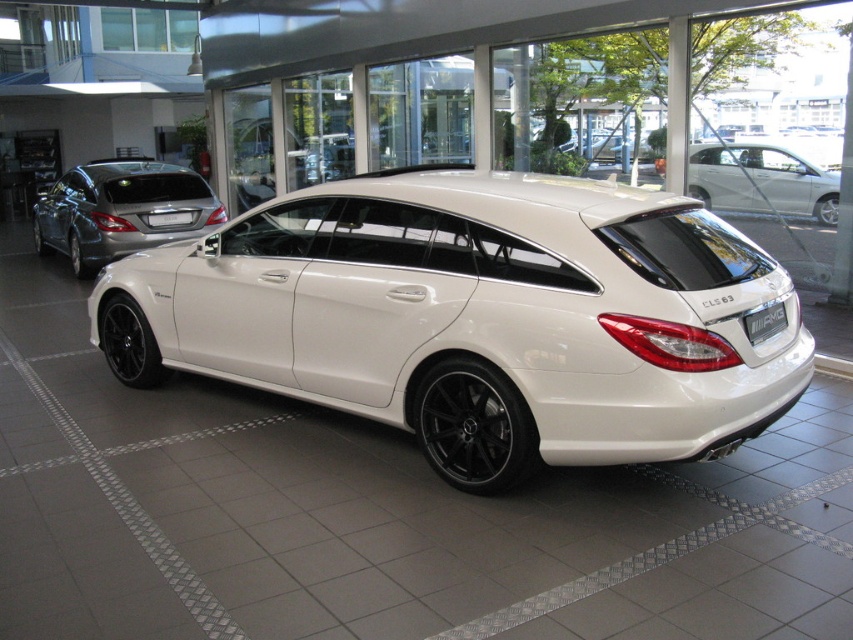
You are standing at the point marked as point [471,396] in the showroom where the Mercedes is displayed. You want to take a photo of the car from exactly 4 meters away. Can you step forward or backward to achieve this distance?

The distance between you and the camera is currently 3.92 meters. To reach exactly 4 meters, you should step backward slightly so that the total distance becomes 4 meters.

You are a delivery person who needs to place a box between the white glossy car at center and the black matte rim at lower center. The box is 20 inches long. Can you fit the box between them without touching either object?

The white glossy car at center and the black matte rim at lower center are 20.01 inches apart. Since the box is 20 inches long, it can fit between them with a small gap of 0.01 inches remaining.